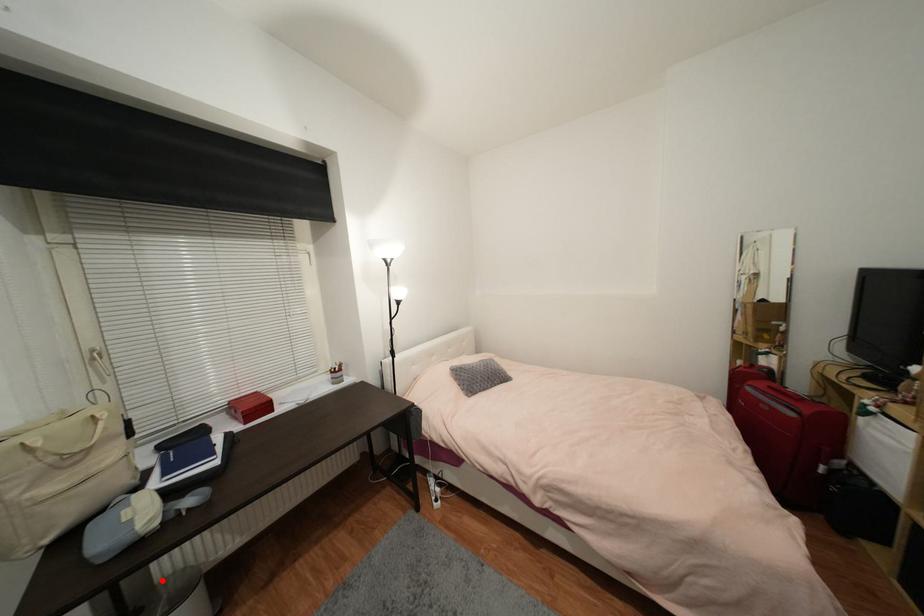
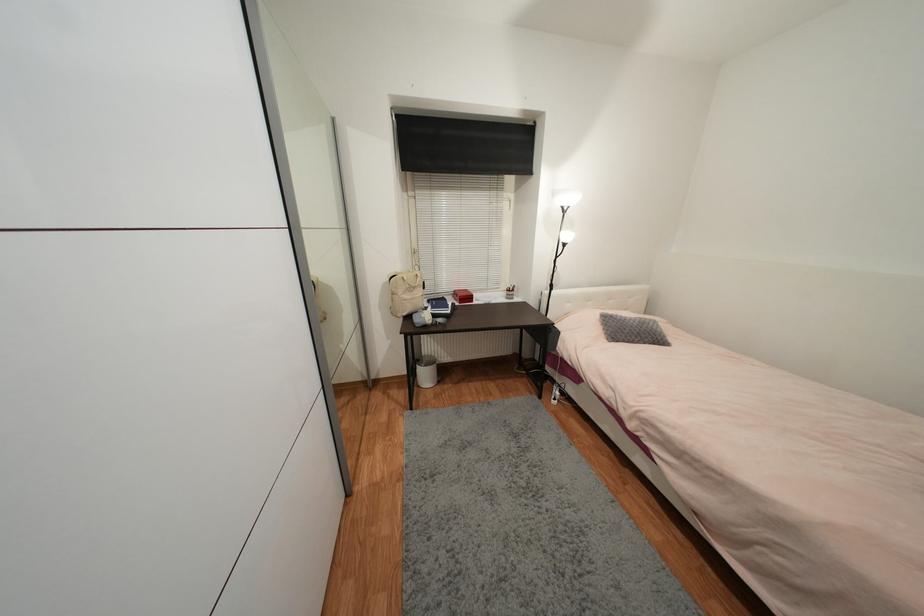
Question: I am providing you with two images of the same scene from different viewpoints. In image1, a red point is highlighted. Considering the same 3D point in image2, which of the following is correct?

Choices:
 (A) It is closer
 (B) It is farther

Answer: (A)